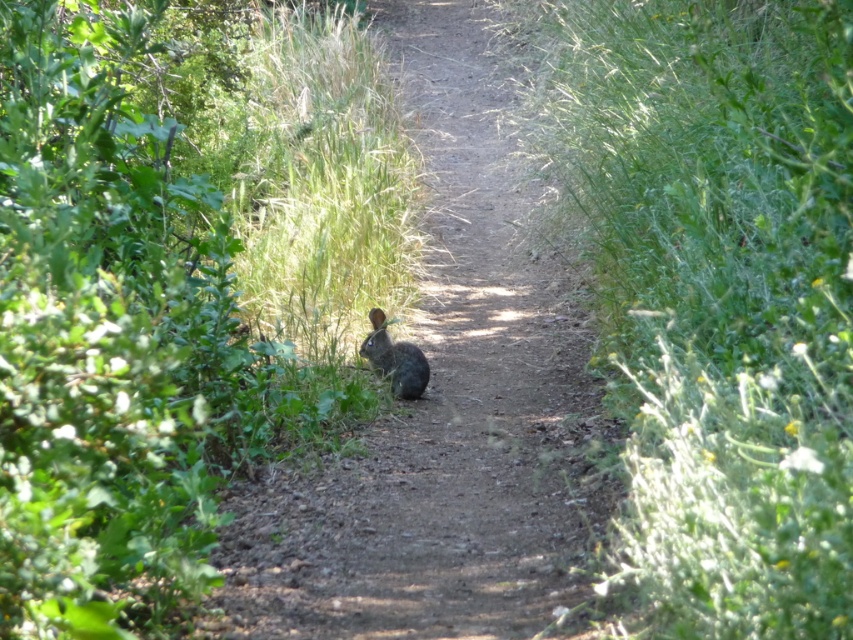
Question: Which of these objects is positioned closest to the fuzzy brown rabbit at center?

Choices:
 (A) green leafy grass at center
 (B) green leafy bush at center
 (C) brown fur rabbit at center

Answer: (C)

Question: Can you confirm if green leafy bush at center is positioned above fuzzy brown rabbit at center?

Choices:
 (A) yes
 (B) no

Answer: (A)

Question: Among these objects, which one is nearest to the camera?

Choices:
 (A) brown fur rabbit at center
 (B) green leafy bush at center
 (C) fuzzy brown rabbit at center

Answer: (B)

Question: Which of the following is the farthest from the observer?

Choices:
 (A) coord(466,336)
 (B) coord(392,381)

Answer: (A)

Question: Does green leafy grass at center have a lesser width compared to brown fur rabbit at center?

Choices:
 (A) no
 (B) yes

Answer: (B)

Question: In this image, where is brown fur rabbit at center located relative to fuzzy brown rabbit at center?

Choices:
 (A) below
 (B) above

Answer: (B)